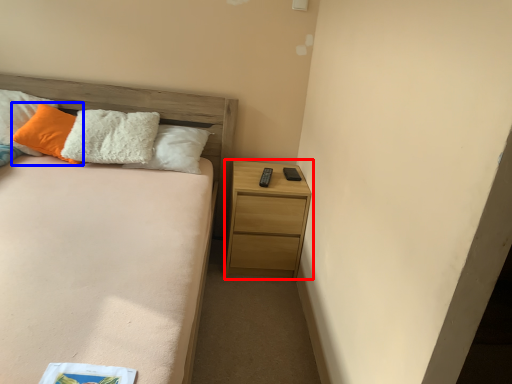
Question: Which object is further to the camera taking this photo, nightstand (highlighted by a red box) or pillow (highlighted by a blue box)?

Choices:
 (A) nightstand
 (B) pillow

Answer: (A)